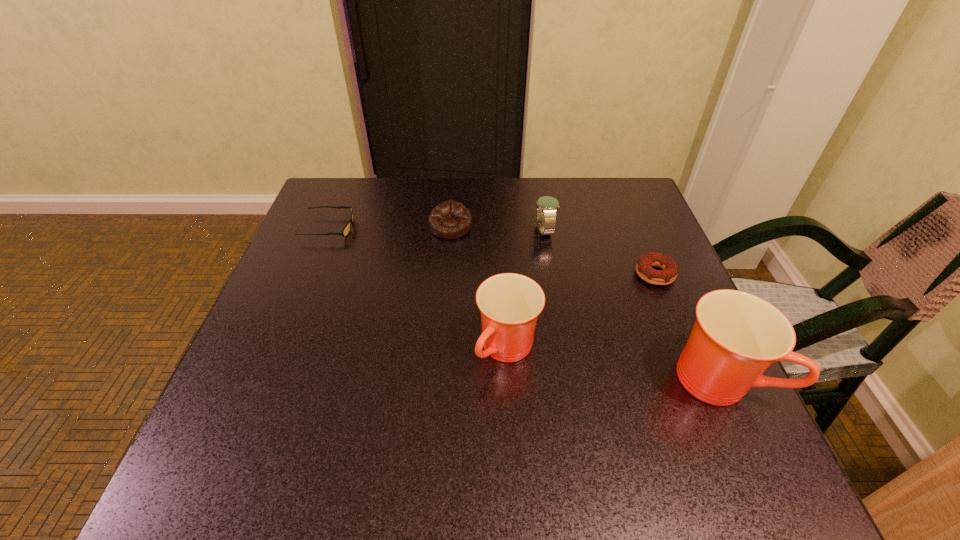
What are the coordinates of `blank area located on the right of the left cup` in the screenshot? It's located at (586, 349).

This screenshot has width=960, height=540. Find the location of `vacant area located on the back of the right cup`. vacant area located on the back of the right cup is located at coordinates (662, 252).

I want to click on free space located on the left of the fourth tallest object, so click(371, 227).

Where is `blank space located 0.230m on the front-facing side of the sunglasses`? blank space located 0.230m on the front-facing side of the sunglasses is located at coordinates (444, 227).

Locate an element on the screen. The height and width of the screenshot is (540, 960). free location located on the front of the watch is located at coordinates 554,289.

At what (x,y) coordinates should I click in order to perform the action: click on vacant position located on the left of the fourth farthest object. Please return your answer as a coordinate pair (x, y). Looking at the image, I should click on (491, 274).

Locate an element on the screen. This screenshot has height=540, width=960. beanbag located in the far edge section of the desktop is located at coordinates (450, 219).

Locate an element on the screen. Image resolution: width=960 pixels, height=540 pixels. sunglasses positioned at the far edge is located at coordinates (347, 228).

Identify the location of watch present at the far edge. (546, 206).

Identify the location of object that is at the near edge. The width and height of the screenshot is (960, 540). (737, 336).